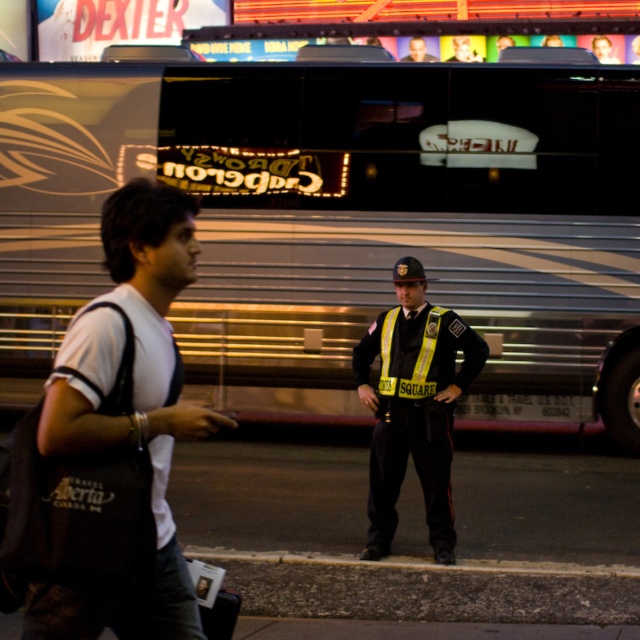
You are a delivery drone operator. Your drone needs to fly from the dark gray backpack at left to the brushed metal bus at center. Based on the scene, can you determine if the drone will need to ascend or descend during this flight?

The brushed metal bus at center is above dark gray backpack at left, so the drone will need to ascend to reach the brushed metal bus at center from the dark gray backpack at left.